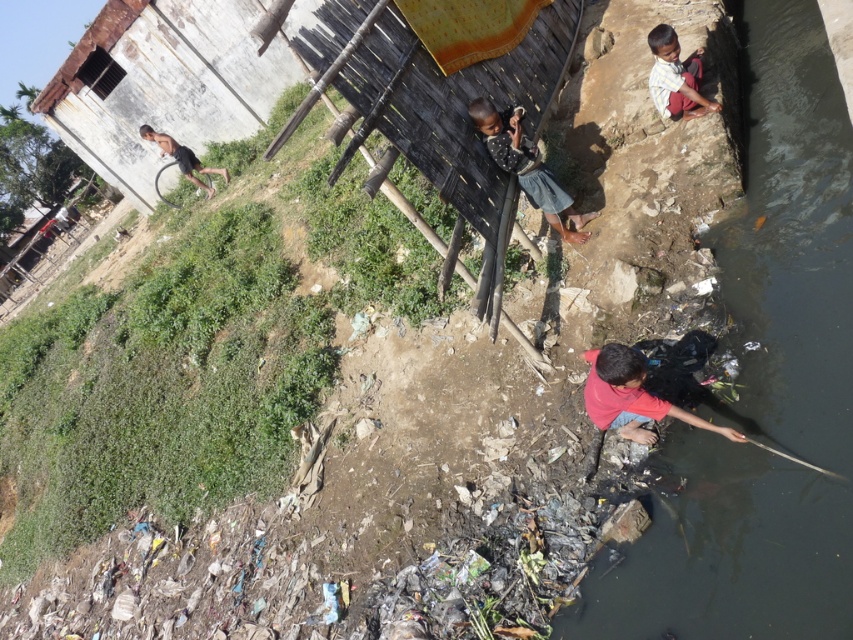
You are a photographer trying to capture the child in the scene. You notice the dark gray fabric at center and the light brown skin at upper right. Which object is positioned lower in the image?

The dark gray fabric at center is below light brown skin at upper right, so the dark gray fabric at center is positioned lower in the image.

You are standing at the point labeled point (650, 45) and want to walk to the point labeled point (540, 189). Which direction should you move to get closer to your destination?

You should move towards the direction of point (540, 189) since it is closer to the camera than point (650, 45).